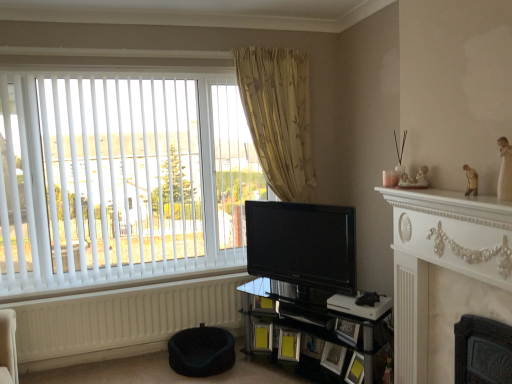
The image size is (512, 384). What do you see at coordinates (121, 178) in the screenshot?
I see `white vertical blinds at left` at bounding box center [121, 178].

Locate an element on the screen. beige floral fabric curtain at upper center is located at coordinates (278, 116).

Image resolution: width=512 pixels, height=384 pixels. Describe the element at coordinates (302, 244) in the screenshot. I see `black glossy tv at center` at that location.

Measure the distance between matte black picture frame at lower center, which is the third picture frame in right-to-left order, and camera.

8.87 feet.

This screenshot has width=512, height=384. I want to click on white vertical blinds at left, so click(x=121, y=178).

Is matte black picture frame at lower center, which is the third picture frame in right-to-left order, turned away from white marble fireplace at right?

No, matte black picture frame at lower center, which is the third picture frame in right-to-left order,'s orientation is not away from white marble fireplace at right.

Considering the sizes of matte black picture frame at lower center, which is the third picture frame in right-to-left order, and white marble fireplace at right in the image, is matte black picture frame at lower center, which is the third picture frame in right-to-left order, wider or thinner than white marble fireplace at right?

matte black picture frame at lower center, which is the third picture frame in right-to-left order, is thinner than white marble fireplace at right.

What's the angular difference between matte black picture frame at lower center, which is the third picture frame in right-to-left order, and white marble fireplace at right's facing directions?

17.6 degrees.

How far apart are matte black picture frame at lower center, which is the third picture frame in right-to-left order, and white marble fireplace at right?

matte black picture frame at lower center, which is the third picture frame in right-to-left order, and white marble fireplace at right are 4.55 feet apart from each other.

From the image's perspective, which is above, beige floral fabric curtain at upper center or matte yellow picture frame at lower center, acting as the fifth picture frame starting from the right?

beige floral fabric curtain at upper center appears higher in the image.

Could you measure the distance between beige floral fabric curtain at upper center and matte yellow picture frame at lower center, arranged as the 2th picture frame when viewed from the left?

beige floral fabric curtain at upper center is 1.47 meters from matte yellow picture frame at lower center, arranged as the 2th picture frame when viewed from the left.

Locate an element on the screen. This screenshot has height=384, width=512. curtain above the matte yellow picture frame at lower center, acting as the fifth picture frame starting from the right (from the image's perspective) is located at coordinates (278, 116).

Does beige floral fabric curtain at upper center turn towards matte yellow picture frame at lower center, acting as the fifth picture frame starting from the right?

No, beige floral fabric curtain at upper center is not oriented towards matte yellow picture frame at lower center, acting as the fifth picture frame starting from the right.

From the image's perspective, which object appears higher, matte yellow picture frame at lower center, acting as the fifth picture frame starting from the right, or yellow matte picture frame at lower center, which is counted as the sixth picture frame, starting from the right?

yellow matte picture frame at lower center, which is counted as the sixth picture frame, starting from the right, is shown above in the image.

Which is correct: matte yellow picture frame at lower center, arranged as the 2th picture frame when viewed from the left, is inside yellow matte picture frame at lower center, positioned as the first picture frame in left-to-right order, or outside of it?

matte yellow picture frame at lower center, arranged as the 2th picture frame when viewed from the left, is not enclosed by yellow matte picture frame at lower center, positioned as the first picture frame in left-to-right order.

Is point (295, 332) in front of point (265, 334)?

Yes, it is.

From the image's perspective, which picture frame is the 2nd one below the yellow matte picture frame at lower center, positioned as the first picture frame in left-to-right order? Please provide its 2D coordinates.

[(289, 345)]

Are black fabric bean bag at lower center and brown matte figurine at upper right far apart?

Yes, black fabric bean bag at lower center and brown matte figurine at upper right are located far from each other.

Is black fabric bean bag at lower center surrounding brown matte figurine at upper right?

No, black fabric bean bag at lower center does not contain brown matte figurine at upper right.

Is black fabric bean bag at lower center in front of brown matte figurine at upper right?

No, black fabric bean bag at lower center is further to the viewer.

From the image's perspective, is black fabric bean bag at lower center located above brown matte figurine at upper right?

Incorrect, from the image's perspective, black fabric bean bag at lower center is lower than brown matte figurine at upper right.

Is matte black picture frame at lower center, which is the fourth picture frame from left to right, smaller than matte yellow picture frame at lower center, acting as the fifth picture frame starting from the right?

Yes.

Would you consider matte black picture frame at lower center, which is the fourth picture frame from left to right, to be distant from matte yellow picture frame at lower center, arranged as the 2th picture frame when viewed from the left?

No, matte black picture frame at lower center, which is the fourth picture frame from left to right, is not far from matte yellow picture frame at lower center, arranged as the 2th picture frame when viewed from the left.

Between matte black picture frame at lower center, which is the third picture frame in right-to-left order, and matte yellow picture frame at lower center, acting as the fifth picture frame starting from the right, which one has more height?

matte black picture frame at lower center, which is the third picture frame in right-to-left order.

Which object is closer to the camera taking this photo, matte black picture frame at lower center, which is the fourth picture frame from left to right, or matte yellow picture frame at lower center, arranged as the 2th picture frame when viewed from the left?

matte black picture frame at lower center, which is the fourth picture frame from left to right, is more forward.

Which point is more distant from viewer, (315, 287) or (254, 329)?

Positioned behind is point (254, 329).

Who is smaller, black glossy tv at center or yellow matte picture frame at lower center, which is counted as the sixth picture frame, starting from the right?

yellow matte picture frame at lower center, which is counted as the sixth picture frame, starting from the right, is smaller.

From a real-world perspective, is black glossy tv at center located beneath yellow matte picture frame at lower center, positioned as the first picture frame in left-to-right order?

No.

Can you tell me how much black glossy tv at center and yellow matte picture frame at lower center, positioned as the first picture frame in left-to-right order, differ in facing direction?

The angular difference between black glossy tv at center and yellow matte picture frame at lower center, positioned as the first picture frame in left-to-right order, is 13.3 degrees.

From the image's perspective, is white marble fireplace at right below white matte radiator at lower left?

No, from the image's perspective, white marble fireplace at right is not below white matte radiator at lower left.

Is white marble fireplace at right directly adjacent to white matte radiator at lower left?

There is a gap between white marble fireplace at right and white matte radiator at lower left.

Does white marble fireplace at right have a smaller size compared to white matte radiator at lower left?

Correct, white marble fireplace at right occupies less space than white matte radiator at lower left.

Considering the sizes of white marble fireplace at right and white matte radiator at lower left in the image, is white marble fireplace at right taller or shorter than white matte radiator at lower left?

Clearly, white marble fireplace at right is shorter compared to white matte radiator at lower left.

Image resolution: width=512 pixels, height=384 pixels. Identify the location of mantle above the matte black picture frame at lower center, which is the fourth picture frame from left to right (from the image's perspective). (452, 205).

The image size is (512, 384). I want to click on picture frame that is the 3rd object located in front of the beige floral fabric curtain at upper center, so click(x=289, y=345).

Estimate the real-world distances between objects in this image. Which object is closer to matte black picture frame at lower center, which is the third picture frame in right-to-left order, black fabric bean bag at lower center or beige floral fabric curtain at upper center?

black fabric bean bag at lower center lies closer to matte black picture frame at lower center, which is the third picture frame in right-to-left order, than the other object.

From the image, which object appears to be nearer to matte black picture frame at lower center, positioned as the second picture frame in right-to-left order, beige floral fabric curtain at upper center or marble fireplace at right, the first fireplace positioned from the bottom?

Among the two, marble fireplace at right, the first fireplace positioned from the bottom, is located nearer to matte black picture frame at lower center, positioned as the second picture frame in right-to-left order.

Which object lies further to the anchor point white marble fireplace at right, black fabric bean bag at lower center or white marble fireplace at right, the second fireplace in the bottom-to-top sequence?

black fabric bean bag at lower center is further to white marble fireplace at right.

Considering their positions, is matte yellow picture frame at lower center, acting as the fifth picture frame starting from the right, positioned closer to beige floral fabric curtain at upper center than matte yellow picture frame at lower center, the 6th picture frame in the left-to-right sequence?

matte yellow picture frame at lower center, acting as the fifth picture frame starting from the right.

Considering their positions, is beige floral fabric curtain at upper center positioned further to white marble fireplace at right, the second fireplace in the bottom-to-top sequence, than marble fireplace at right, the first fireplace positioned from the bottom?

beige floral fabric curtain at upper center.

Which object lies nearer to the anchor point beige floral fabric curtain at upper center, white matte radiator at lower left or white marble fireplace at right?

white matte radiator at lower left lies closer to beige floral fabric curtain at upper center than the other object.

From the image, which object appears to be nearer to matte yellow picture frame at lower center, the first picture frame viewed from the right, matte yellow picture frame at lower center, acting as the fifth picture frame starting from the right, or black fabric bean bag at lower center?

matte yellow picture frame at lower center, acting as the fifth picture frame starting from the right, is positioned closer to the anchor matte yellow picture frame at lower center, the first picture frame viewed from the right.

Considering their positions, is marble fireplace at right, the first fireplace positioned from the bottom, positioned further to black glass shelf at lower center than black fabric bean bag at lower center?

marble fireplace at right, the first fireplace positioned from the bottom, lies further to black glass shelf at lower center than the other object.

Find the location of `television between black fabric bean bag at lower center and brown matte figurine at upper right`. television between black fabric bean bag at lower center and brown matte figurine at upper right is located at coordinates click(x=302, y=244).

You are a GUI agent. You are given a task and a screenshot of the screen. Output one action in this format:
    pyautogui.click(x=<x>, y=<y>)
    Task: Click on the television positioned between white marble fireplace at right and beige floral fabric curtain at upper center from near to far
    The height and width of the screenshot is (384, 512).
    Given the screenshot: What is the action you would take?
    pyautogui.click(x=302, y=244)

Where is `picture frame located between marble fireplace at right, the 2th fireplace viewed from the top, and matte yellow picture frame at lower center, the 6th picture frame in the left-to-right sequence, in the depth direction`? picture frame located between marble fireplace at right, the 2th fireplace viewed from the top, and matte yellow picture frame at lower center, the 6th picture frame in the left-to-right sequence, in the depth direction is located at coordinates (347, 331).

Identify the location of fireplace located between white matte radiator at lower left and marble fireplace at right, the first fireplace positioned from the bottom, in the left-right direction. (445, 274).